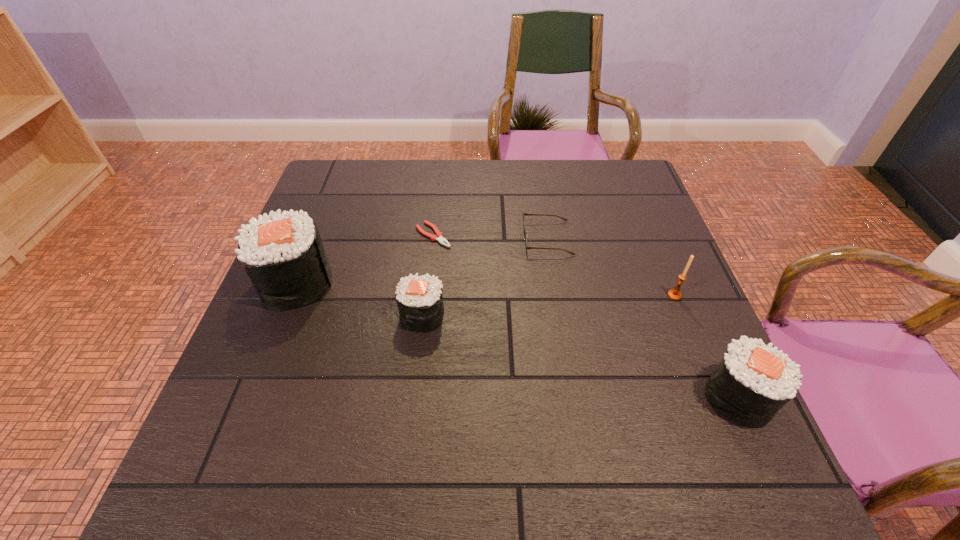
Identify the location of free spot located on the right of the leftmost sushi. The width and height of the screenshot is (960, 540). (445, 283).

This screenshot has height=540, width=960. Identify the location of vacant region located on the right of the second sushi from left to right. (591, 315).

Find the location of a particular element. vacant space situated 0.230m on the left of the second shortest sushi is located at coordinates (586, 396).

Locate an element on the screen. Image resolution: width=960 pixels, height=540 pixels. vacant space situated on the front of the shortest object is located at coordinates (418, 373).

Identify the location of blank space located on the left of the candle_holder. (561, 295).

At what (x,y) coordinates should I click in order to perform the action: click on vacant area situated on the front-facing side of the fifth tallest object. Please return your answer as a coordinate pair (x, y). The height and width of the screenshot is (540, 960). Looking at the image, I should click on (422, 238).

The image size is (960, 540). In order to click on vacant space located on the front-facing side of the fifth tallest object in this screenshot , I will do `click(393, 238)`.

You are a GUI agent. You are given a task and a screenshot of the screen. Output one action in this format:
    pyautogui.click(x=<x>, y=<y>)
    Task: Click on the vacant space situated on the front-facing side of the fifth tallest object
    This screenshot has width=960, height=540.
    Given the screenshot: What is the action you would take?
    pyautogui.click(x=452, y=238)

The image size is (960, 540). I want to click on object that is at the near edge, so click(753, 381).

I want to click on object present at the left edge, so pyautogui.click(x=283, y=255).